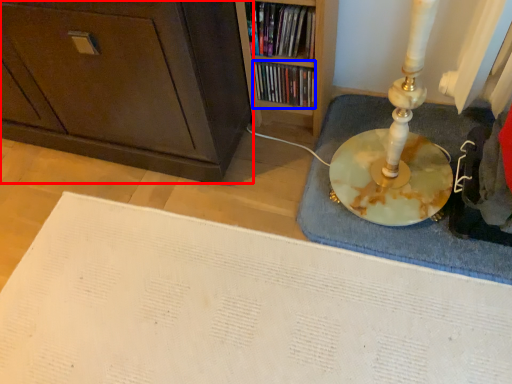
Question: Which object is closer to the camera taking this photo, cabinetry (highlighted by a red box) or book (highlighted by a blue box)?

Choices:
 (A) cabinetry
 (B) book

Answer: (A)